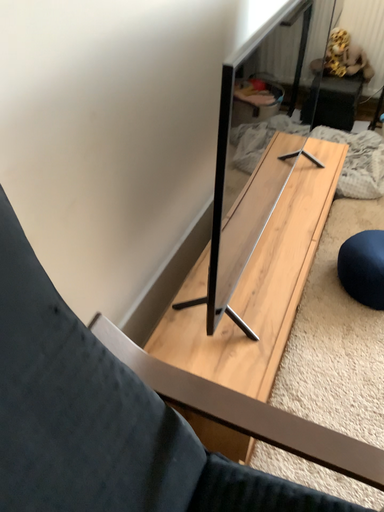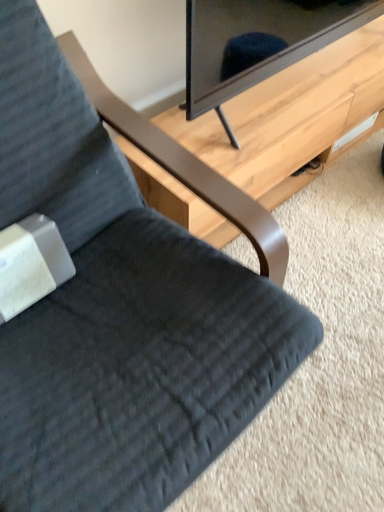
Question: Which way did the camera rotate in the video?

Choices:
 (A) rotated left
 (B) rotated right

Answer: (A)